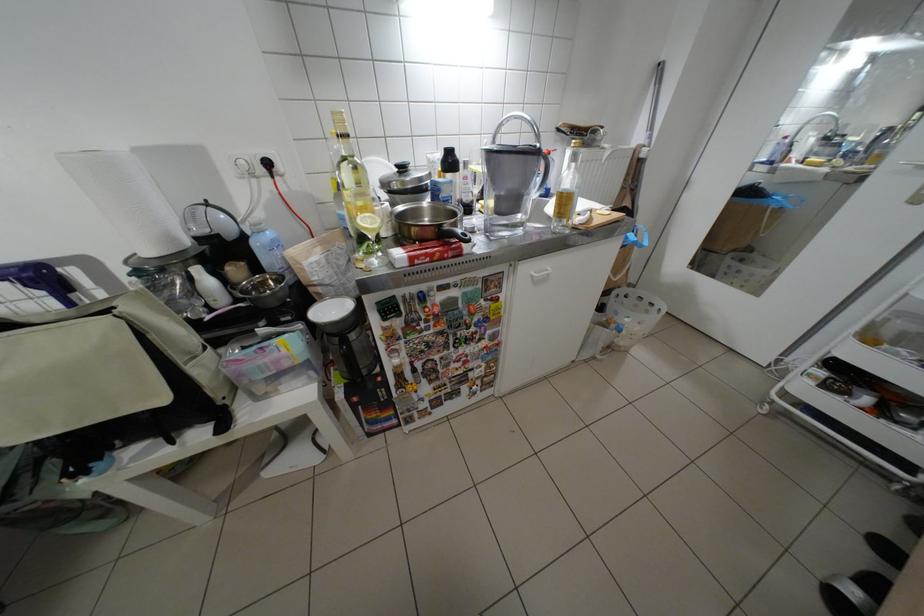
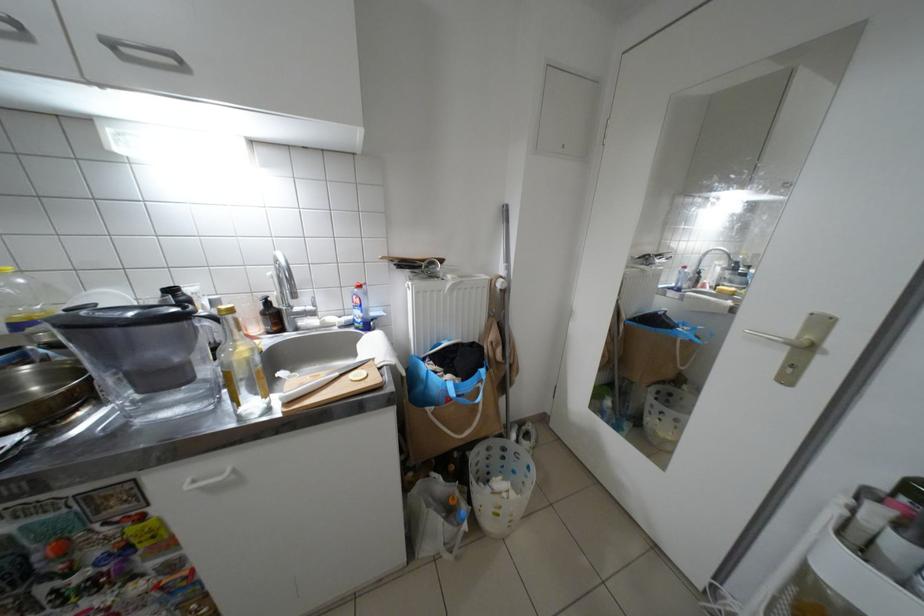
Locate, in the second image, the point that corresponds to (613,346) in the first image.

(453, 541)